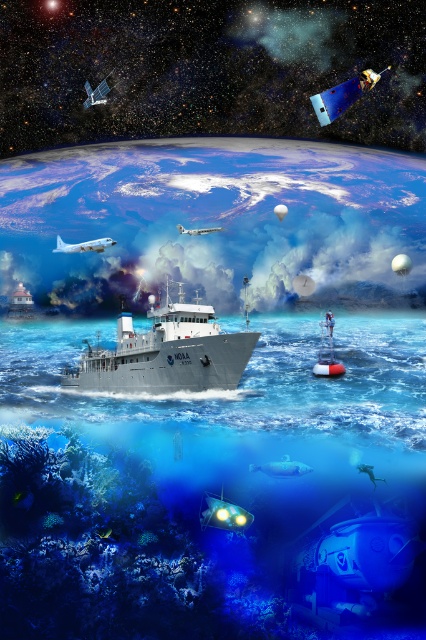
Question: Can you confirm if translucent blue water at center is thinner than white matte ship at center?

Choices:
 (A) yes
 (B) no

Answer: (B)

Question: Which point is farther to the camera?

Choices:
 (A) (170, 324)
 (B) (305, 563)

Answer: (A)

Question: Does translucent blue water at center have a greater width compared to white matte ship at center?

Choices:
 (A) yes
 (B) no

Answer: (A)

Question: Among these objects, which one is nearest to the camera?

Choices:
 (A) translucent blue water at center
 (B) white matte ship at center

Answer: (A)

Question: Can you confirm if translucent blue water at center is smaller than white matte ship at center?

Choices:
 (A) yes
 (B) no

Answer: (B)